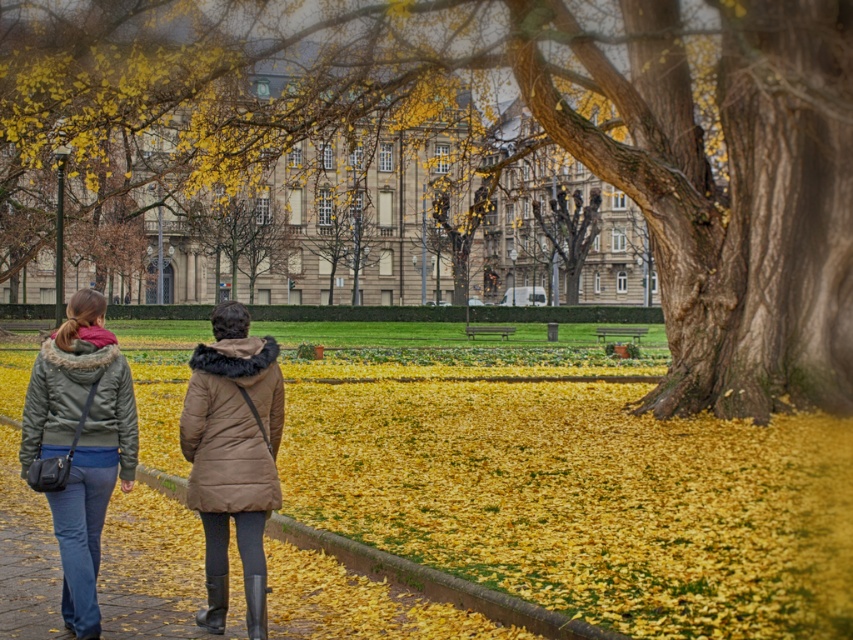
Question: Is the position of brown puffy coat at center more distant than that of matte green coat at left?

Choices:
 (A) no
 (B) yes

Answer: (A)

Question: Which of the following is the closest to the observer?

Choices:
 (A) (273, 472)
 (B) (108, 456)

Answer: (A)

Question: Among these points, which one is farthest from the camera?

Choices:
 (A) (105, 408)
 (B) (752, 291)
 (C) (91, 228)
 (D) (216, 445)

Answer: (C)

Question: Which of the following is the closest to the observer?

Choices:
 (A) smooth bark tree at center right
 (B) brown puffy coat at center
 (C) matte green coat at left
 (D) brown stone building at center

Answer: (B)

Question: Observing the image, what is the correct spatial positioning of smooth bark tree at center right in reference to matte brown coat at center?

Choices:
 (A) left
 (B) right

Answer: (B)

Question: Does matte green jacket at lower left appear on the left side of matte green coat at left?

Choices:
 (A) no
 (B) yes

Answer: (A)